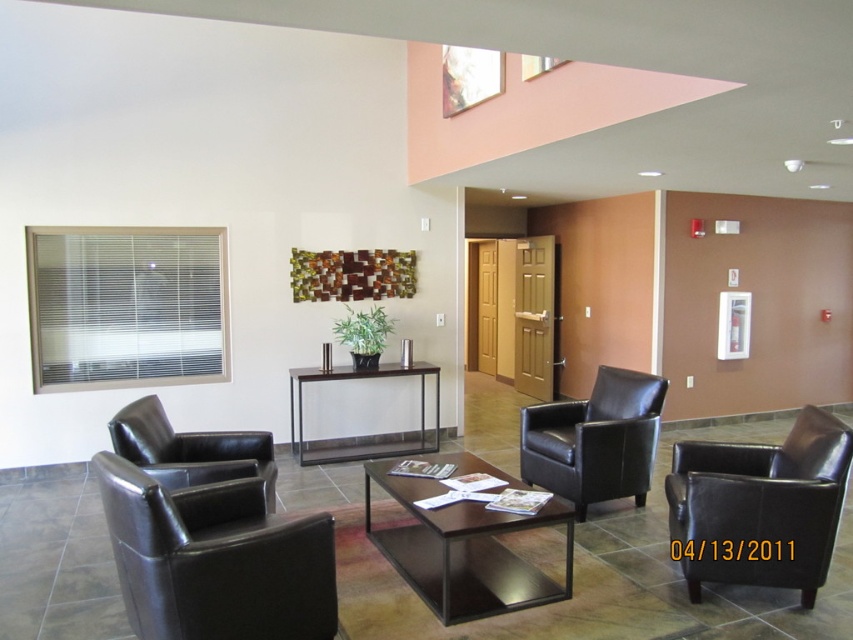
You are planning to rearrange the furniture in the room. If you want to move the black leather armchair at left closer to the dark brown wood coffee table at center, will the chair fit entirely within the table? Please explain your reasoning based on their sizes.

The dark brown wood coffee table at center is larger in size than the black leather armchair at left. Therefore, the black leather armchair at left cannot fit entirely within the table because the table is bigger than the chair.

You are standing at the center of the room and want to move towards the black leather armchair at left. Based on its coordinates, which direction should you move?

The black leather armchair at left is located at coordinates point (190,449), so you should move towards the left side of the room to reach it.